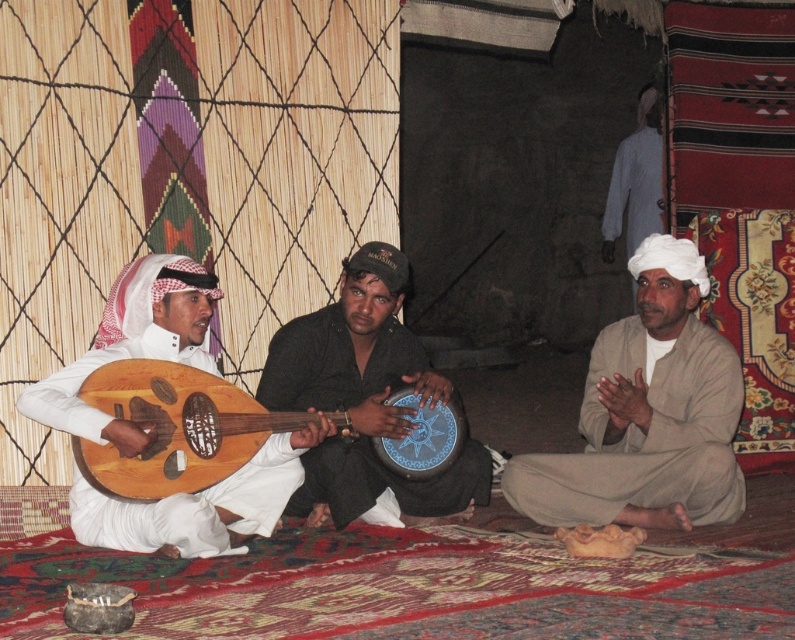
Question: Which object is farther from the camera taking this photo?

Choices:
 (A) beige cotton turban at right
 (B) gray cotton shirt at upper right
 (C) wooden lute at left
 (D) dark brown leather drum at center

Answer: (B)

Question: Is dark brown leather drum at center positioned in front of gray cotton shirt at upper right?

Choices:
 (A) no
 (B) yes

Answer: (B)

Question: Which object is the closest to the beige cotton turban at right?

Choices:
 (A) wooden lute at left
 (B) wooden banjo at left

Answer: (B)

Question: Which object appears farthest from the camera in this image?

Choices:
 (A) beige cotton turban at right
 (B) gray cotton shirt at upper right
 (C) wooden lute at left

Answer: (B)

Question: From the image, what is the correct spatial relationship of wooden banjo at left in relation to gray cotton shirt at upper right?

Choices:
 (A) above
 (B) below

Answer: (B)

Question: Does wooden banjo at left have a greater width compared to gray cotton shirt at upper right?

Choices:
 (A) no
 (B) yes

Answer: (B)